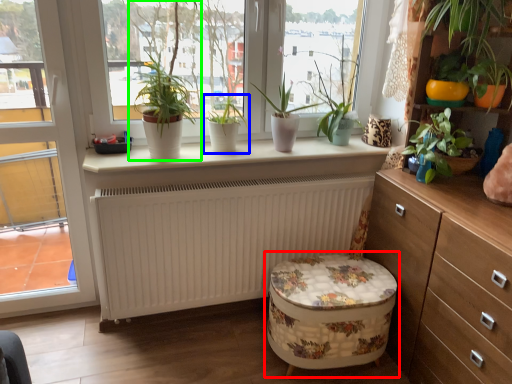
Question: Which is nearer to the swivel chair (highlighted by a red box)? houseplant (highlighted by a blue box) or houseplant (highlighted by a green box).

Choices:
 (A) houseplant
 (B) houseplant

Answer: (A)